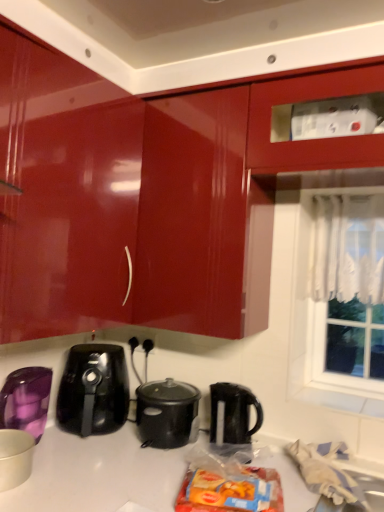
Locate an element on the screen. vacant space in front of white lace curtain at upper right is located at coordinates (349, 409).